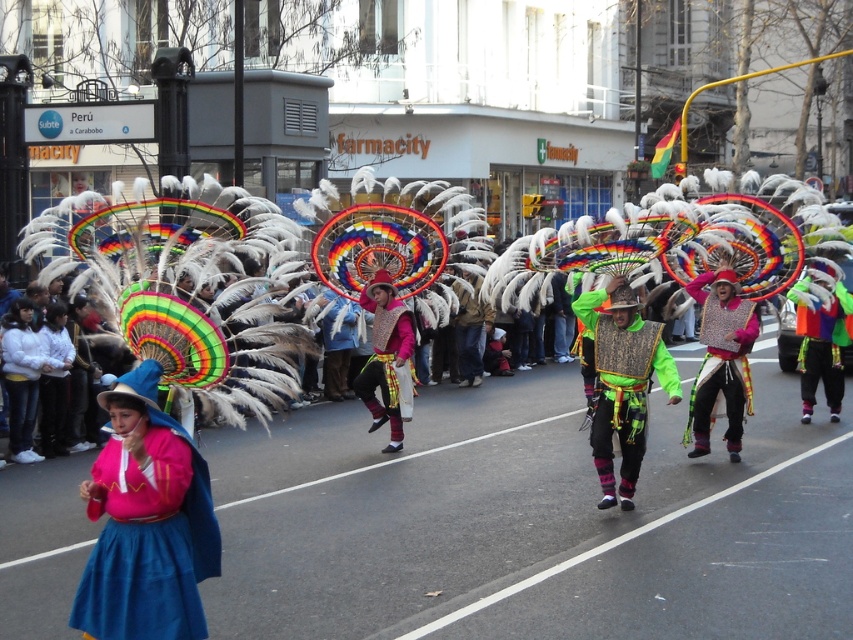
You are a photographer trying to capture the vibrant street parade. You notice the matte pink sweater at center. Based on its position, can you determine if it will be visible in a photo taken from the street level looking towards the performers?

The matte pink sweater at center is located at point (148,524), which means it is positioned in the lower right quadrant of the frame. Since the photographer is at street level facing the performers, this sweater should be clearly visible in the photo.

Based on the photo, you are a participant in the parade and want to move from your current position to the end of the parade route. You notice two points marked on the ground ahead of you. The first is at point (387, 316) and the second is at point (846, 342). Which point is closer to you?

Point (387, 316) is closer to you because it is in front of point (846, 342).